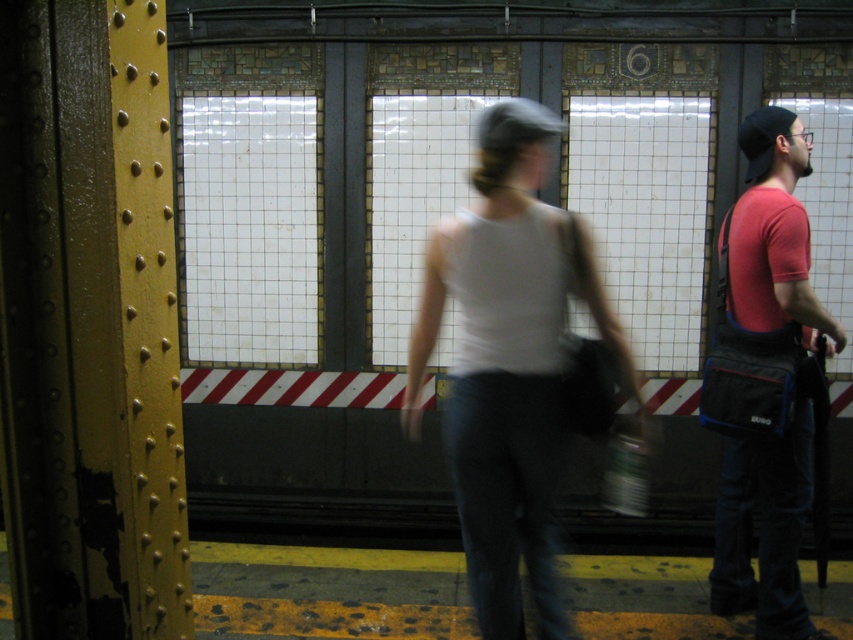
Question: Which object is farther from the camera taking this photo?

Choices:
 (A) red fabric bag at right
 (B) white matte tank top at center

Answer: (A)

Question: Does white matte tank top at center appear on the left side of red fabric bag at right?

Choices:
 (A) no
 (B) yes

Answer: (B)

Question: Is white matte tank top at center bigger than red fabric bag at right?

Choices:
 (A) yes
 (B) no

Answer: (A)

Question: Does white matte tank top at center have a greater width compared to red fabric bag at right?

Choices:
 (A) no
 (B) yes

Answer: (B)